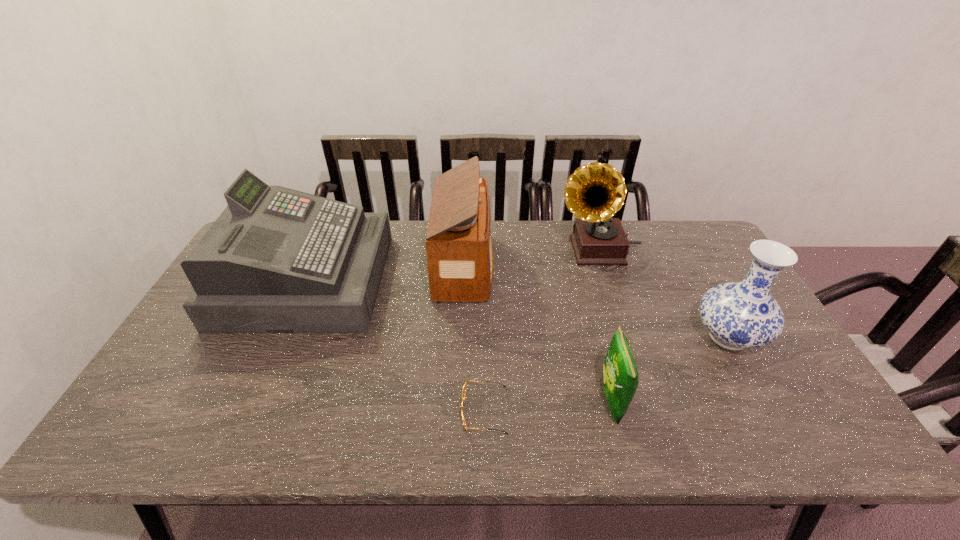
Identify which object is the fourth closest to the radio receiver. Please provide its 2D coordinates. Your answer should be formatted as a tuple, i.e. [(x, y)], where the tuple contains the x and y coordinates of a point satisfying the conditions above.

[(620, 376)]

Choose which object is the third nearest neighbor to the phonograph record. Please provide its 2D coordinates. Your answer should be formatted as a tuple, i.e. [(x, y)], where the tuple contains the x and y coordinates of a point satisfying the conditions above.

[(620, 376)]

Locate an element on the screen. This screenshot has height=540, width=960. vacant space that satisfies the following two spatial constraints: 1. from the horn of the phonograph record; 2. on the back side of the vase is located at coordinates (626, 337).

Find the location of a particular element. blank space that satisfies the following two spatial constraints: 1. on the front side of the vase; 2. on the front-facing side of the second shortest object is located at coordinates (764, 401).

Find the location of `vacant space that satisfies the following two spatial constraints: 1. from the horn of the phonograph record; 2. on the left side of the vase`. vacant space that satisfies the following two spatial constraints: 1. from the horn of the phonograph record; 2. on the left side of the vase is located at coordinates (626, 337).

Where is `free location that satisfies the following two spatial constraints: 1. on the front panel of the radio receiver; 2. on the right side of the rightmost object`? The width and height of the screenshot is (960, 540). free location that satisfies the following two spatial constraints: 1. on the front panel of the radio receiver; 2. on the right side of the rightmost object is located at coordinates (462, 337).